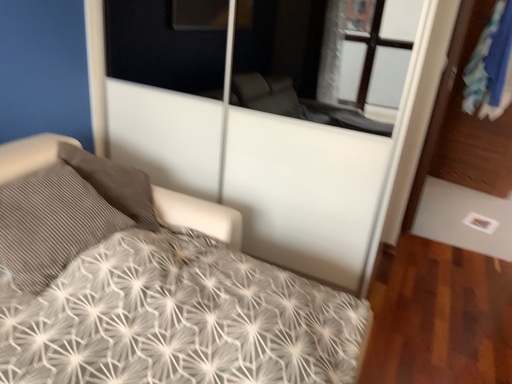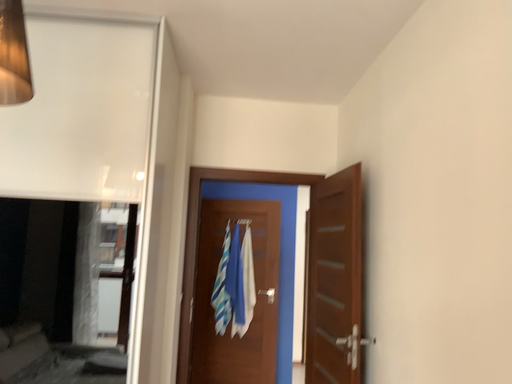
Question: How did the camera likely rotate when shooting the video?

Choices:
 (A) rotated upward
 (B) rotated downward

Answer: (A)